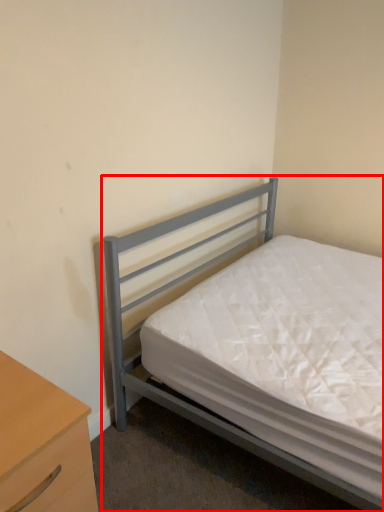
Question: Where is bed (annotated by the red box) located in relation to nightstand in the image?

Choices:
 (A) left
 (B) right

Answer: (B)